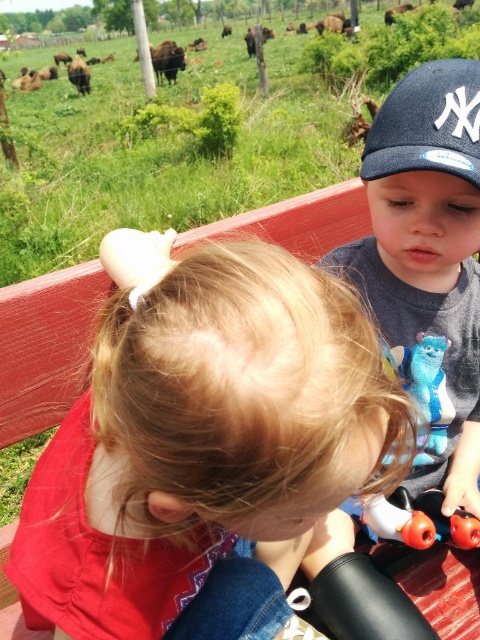
You are a photographer trying to capture a photo of the blue plush toy at center. To avoid including the blue fabric baseball cap at upper right in the photo, which direction should you move the camera?

Move the camera to the right so that the blue fabric baseball cap at upper right is no longer in the frame. Since the blue fabric baseball cap at upper right is to the right of the blue plush toy at center, moving the camera right will shift the frame away from the cap.

You are a photographer trying to capture both the dark blue cotton cap at upper right and the blue fabric baseball cap at upper right in a single shot. Which cap should you focus on first to ensure both are in frame?

The dark blue cotton cap at upper right is larger in size than the blue fabric baseball cap at upper right, so you should focus on the dark blue cotton cap at upper right first to ensure both are in frame.

You are a photographer trying to capture a photo of both children in the wagon. You notice two points of interest marked as point (96, 502) and point (373, 266). Which point should you focus on first to ensure both children are in focus?

You should focus on point (96, 502) first because it is closer to the viewer than point (373, 266). This will help ensure both children are in focus as the closer point will be within the depth of field when focused properly.